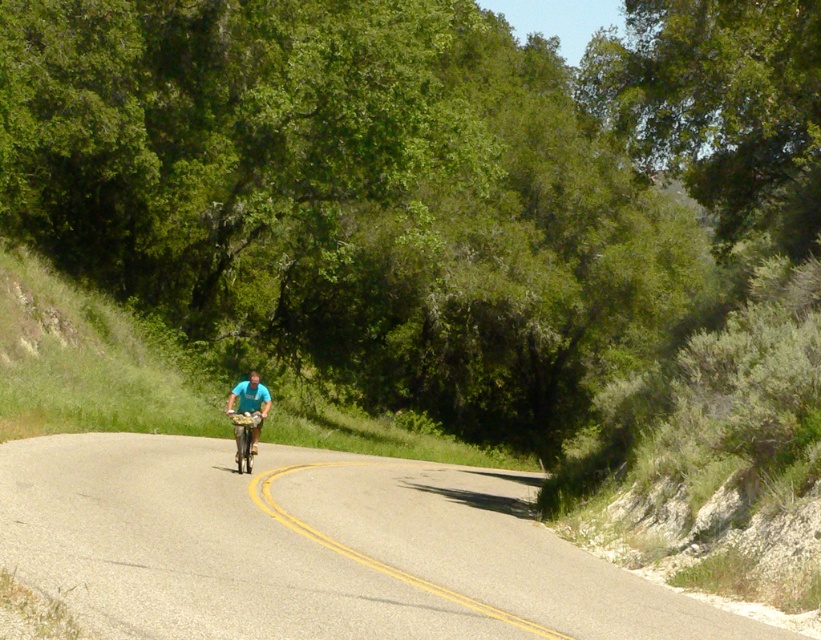
Question: Which point is farther from the camera taking this photo?

Choices:
 (A) (245, 451)
 (B) (304, 547)
 (C) (267, 400)

Answer: (C)

Question: Which of the following is the farthest from the observer?

Choices:
 (A) (248, 445)
 (B) (5, 525)
 (C) (257, 396)

Answer: (C)

Question: Which object is positioned farthest from the gray asphalt road at center?

Choices:
 (A) blue matte shirt at center
 (B) shiny metallic bicycle at center

Answer: (A)

Question: Where is gray asphalt road at center located in relation to shiny metallic bicycle at center in the image?

Choices:
 (A) left
 (B) right

Answer: (B)

Question: Is blue matte shirt at center thinner than shiny metallic bicycle at center?

Choices:
 (A) yes
 (B) no

Answer: (B)

Question: Is gray asphalt road at center positioned behind blue matte shirt at center?

Choices:
 (A) no
 (B) yes

Answer: (A)